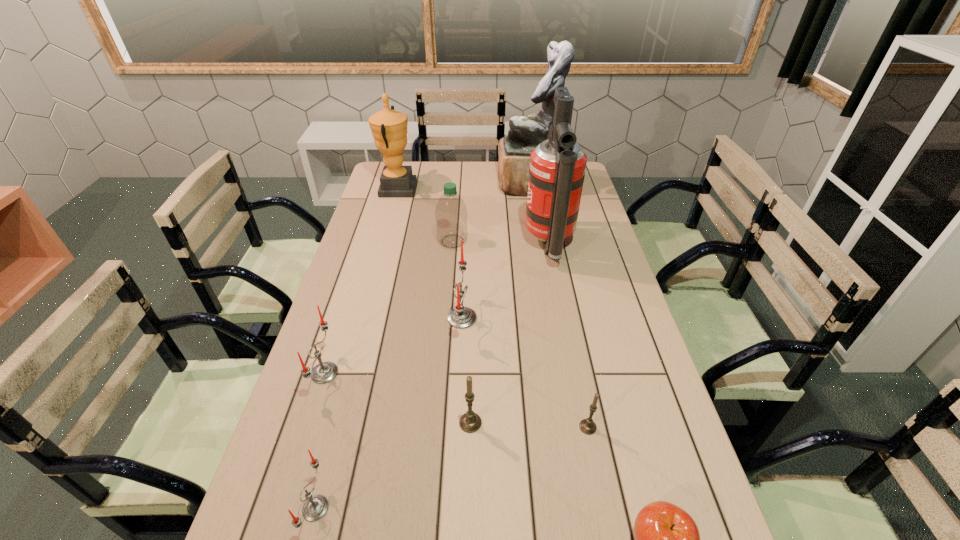
Identify the location of sculpture. The width and height of the screenshot is (960, 540). (525, 133).

Where is `fire extinguisher`? Image resolution: width=960 pixels, height=540 pixels. fire extinguisher is located at coordinates (557, 168).

The image size is (960, 540). In order to click on award in this screenshot , I will do `click(389, 127)`.

Identify the location of golden award. Image resolution: width=960 pixels, height=540 pixels. (389, 127).

Find the location of a particular element. green water bottle is located at coordinates (451, 214).

Where is `the biggest red candle`? This screenshot has width=960, height=540. the biggest red candle is located at coordinates (460, 317).

Where is `the farthest red candle`? The width and height of the screenshot is (960, 540). the farthest red candle is located at coordinates (460, 317).

Find the location of a particular element. the bigger gray candle is located at coordinates (470, 422).

Identify the location of the second biggest red candle. (324, 372).

At what (x,y) coordinates should I click in order to perform the action: click on the second farthest candle. Please return your answer as a coordinate pair (x, y). The height and width of the screenshot is (540, 960). Looking at the image, I should click on 324,372.